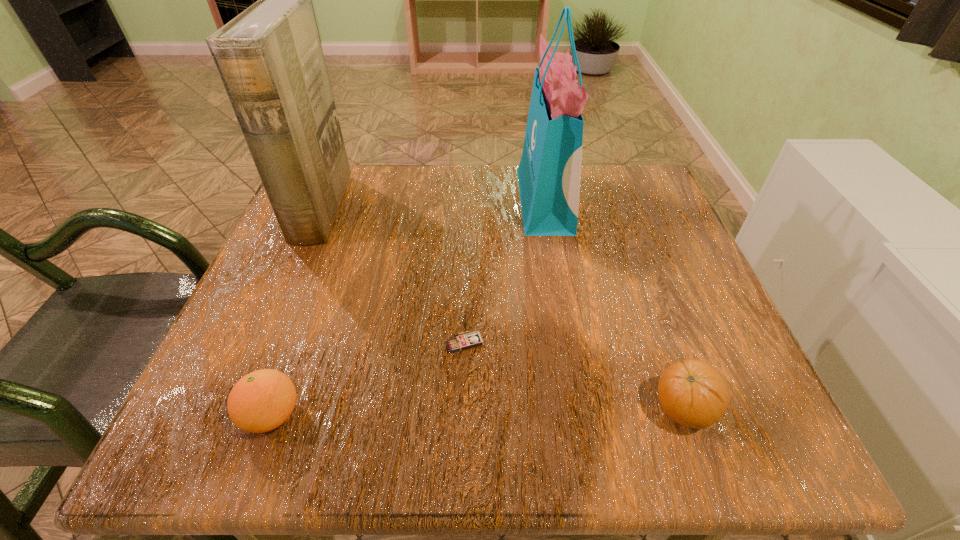
Where is `the fourth object from left to right`? The width and height of the screenshot is (960, 540). the fourth object from left to right is located at coordinates (549, 173).

The width and height of the screenshot is (960, 540). I want to click on phonebook, so click(x=270, y=60).

At what (x,y) coordinates should I click in order to perform the action: click on the third nearest object. Please return your answer as a coordinate pair (x, y). The width and height of the screenshot is (960, 540). Looking at the image, I should click on (471, 339).

Identify the location of matchbox. (471, 339).

In order to click on the right orange in this screenshot , I will do `click(693, 393)`.

Image resolution: width=960 pixels, height=540 pixels. I want to click on the left orange, so click(x=262, y=400).

Locate an element on the screen. free region located on the front of the shopping bag is located at coordinates (583, 416).

Identify the location of free region located on the cover of the phonebook. The width and height of the screenshot is (960, 540). (461, 210).

Locate an element on the screen. free space located 0.160m on the front of the third object from right to left is located at coordinates (462, 451).

Locate an element on the screen. This screenshot has width=960, height=540. blank area located 0.300m on the back of the rightmost object is located at coordinates (627, 252).